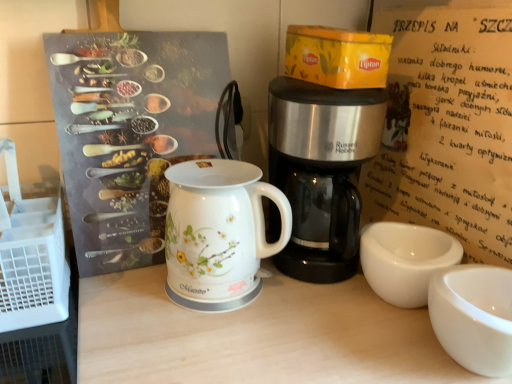
Question: Is white paper at upper right wider than white glossy cup at lower right?

Choices:
 (A) no
 (B) yes

Answer: (A)

Question: Is white paper at upper right not near white glossy cup at lower right?

Choices:
 (A) no
 (B) yes

Answer: (A)

Question: Is white glossy cup at lower right at the back of white paper at upper right?

Choices:
 (A) yes
 (B) no

Answer: (B)

Question: From a real-world perspective, is white paper at upper right beneath white glossy cup at lower right?

Choices:
 (A) yes
 (B) no

Answer: (B)

Question: From a real-world perspective, is white paper at upper right on top of white glossy cup at lower right?

Choices:
 (A) yes
 (B) no

Answer: (A)

Question: Is white paper at upper right taller than white glossy cup at lower right?

Choices:
 (A) yes
 (B) no

Answer: (A)

Question: Is white paper at upper right completely or partially outside of stainless steel coffee maker at center?

Choices:
 (A) no
 (B) yes

Answer: (B)

Question: Can you confirm if white paper at upper right is smaller than stainless steel coffee maker at center?

Choices:
 (A) yes
 (B) no

Answer: (A)

Question: Is white paper at upper right far from stainless steel coffee maker at center?

Choices:
 (A) yes
 (B) no

Answer: (B)

Question: Is white paper at upper right positioned behind stainless steel coffee maker at center?

Choices:
 (A) no
 (B) yes

Answer: (A)

Question: From a real-world perspective, is white paper at upper right over stainless steel coffee maker at center?

Choices:
 (A) no
 (B) yes

Answer: (B)

Question: Is white paper at upper right looking in the opposite direction of stainless steel coffee maker at center?

Choices:
 (A) no
 (B) yes

Answer: (B)

Question: Considering the relative positions of white glossy cup at lower right and stainless steel coffee maker at center in the image provided, is white glossy cup at lower right behind stainless steel coffee maker at center?

Choices:
 (A) no
 (B) yes

Answer: (A)